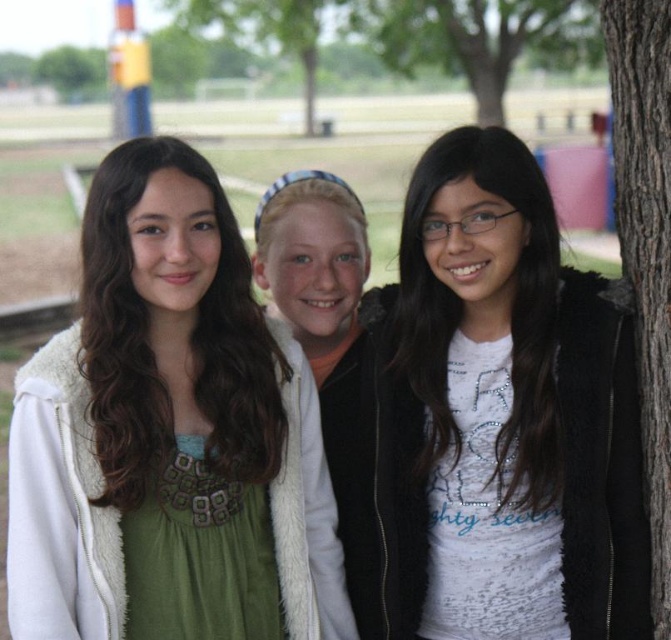
Question: Is white matte jacket at center behind brown rough bark tree at right?

Choices:
 (A) no
 (B) yes

Answer: (B)

Question: Does green fabric dress at center appear on the left side of brown textured tree trunk at upper center?

Choices:
 (A) yes
 (B) no

Answer: (A)

Question: Is white matte jacket at center wider than brown rough bark tree at right?

Choices:
 (A) no
 (B) yes

Answer: (B)

Question: Among these objects, which one is nearest to the camera?

Choices:
 (A) green fabric dress at center
 (B) white matte jacket at center
 (C) brown rough bark tree at right
 (D) brown textured tree trunk at upper center

Answer: (A)

Question: Which of the following is the farthest from the observer?

Choices:
 (A) (185, 20)
 (B) (505, 552)

Answer: (A)

Question: Among these objects, which one is farthest from the camera?

Choices:
 (A) brown rough bark tree at right
 (B) green leafy tree at upper center
 (C) white matte jacket at center

Answer: (B)